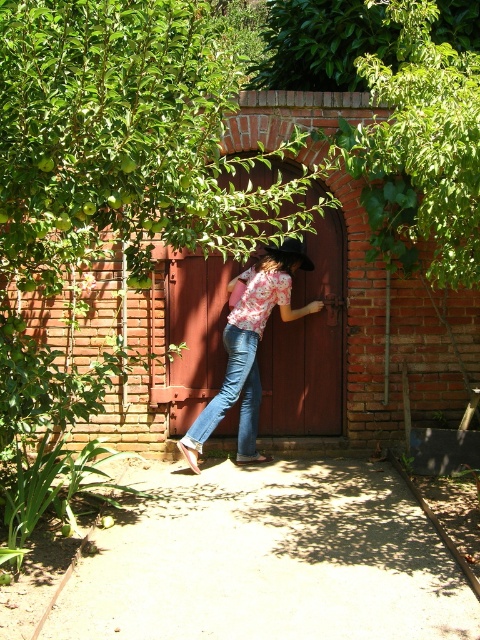
You are a photographer trying to capture the person in the scene. You need to ensure that both the floral shirt and jeans at center and the brown felt cowboy hat at center are fully visible in the frame. Based on their sizes, which object might require you to adjust your camera angle to avoid cropping?

The floral shirt and jeans at center might be wider than the brown felt cowboy hat at center, so you might need to adjust the camera angle to ensure the wider floral shirt and jeans at center fits within the frame without being cropped.

You are a fashion designer observing a model wearing a floral shirt and jeans at center and denim jeans at center. Which clothing item is closer to the camera?

The floral shirt and jeans at center is closer to the camera than the denim jeans at center because it is 5.19 inches closer.